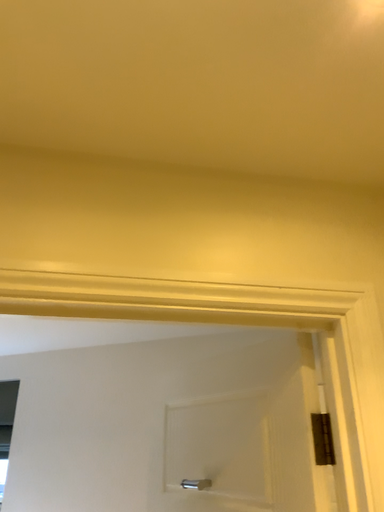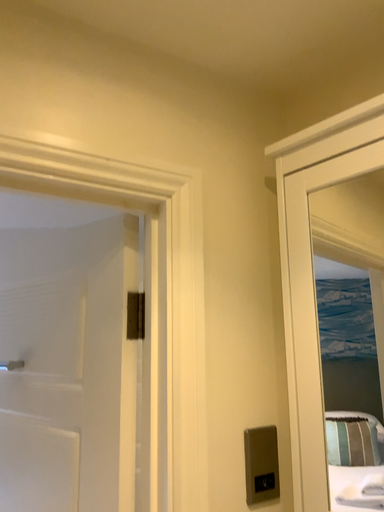
Question: Which way did the camera rotate in the video?

Choices:
 (A) rotated downward
 (B) rotated upward

Answer: (A)